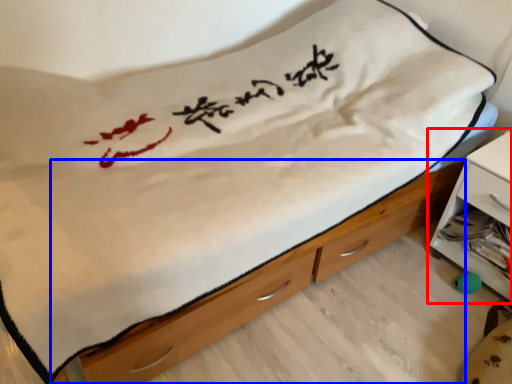
Question: Which point is further to the camera, nightstand (highlighted by a red box) or chest of drawers (highlighted by a blue box)?

Choices:
 (A) nightstand
 (B) chest of drawers

Answer: (A)